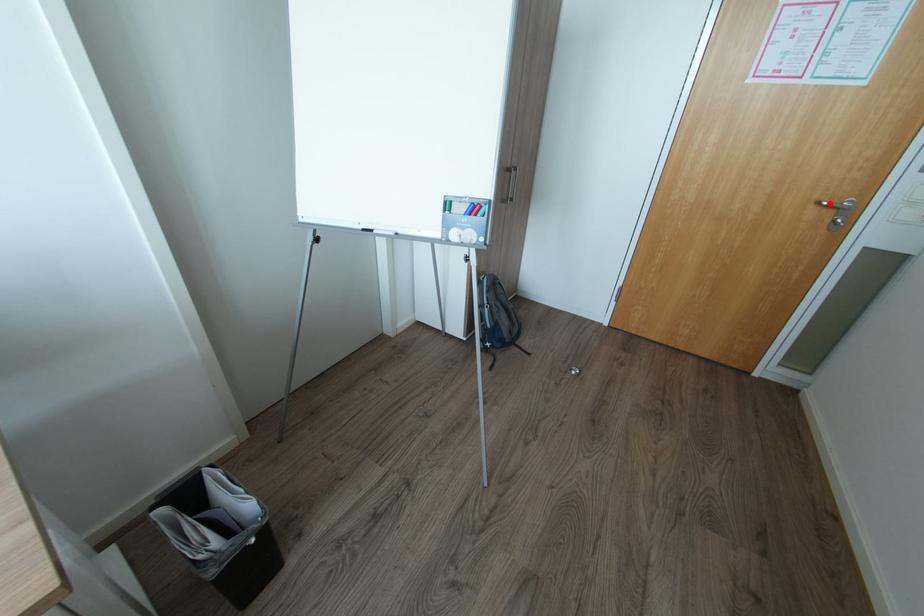
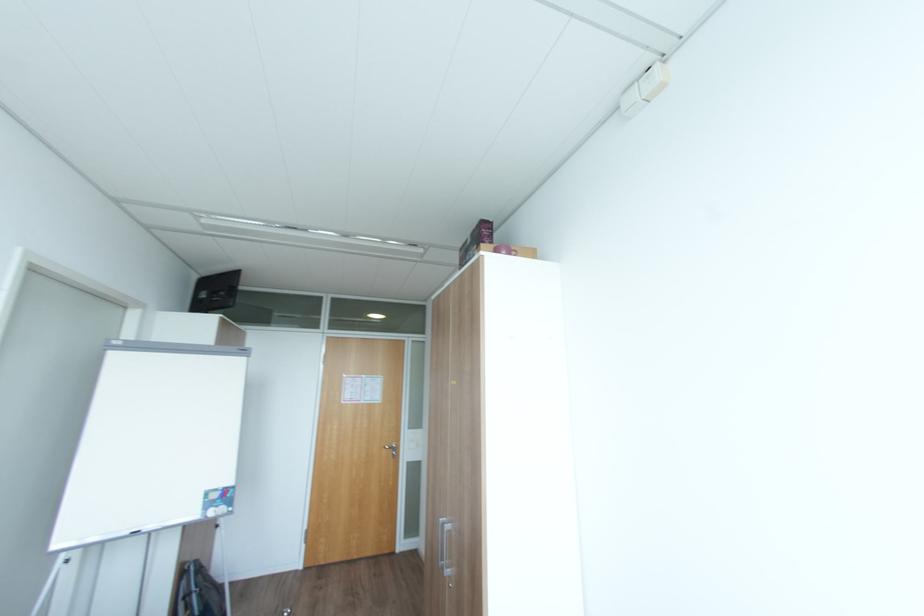
Locate, in the second image, the point that corresponds to the highlighted location in the first image.

(392, 448)